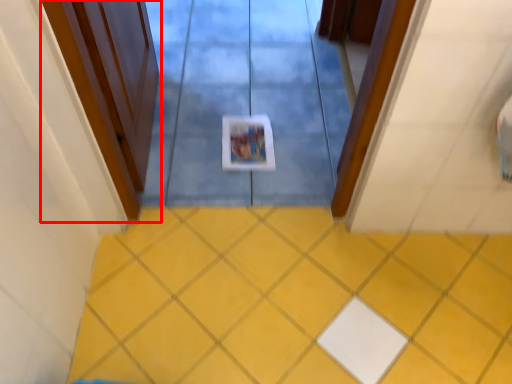
Question: From the image, what is the correct spatial relationship of door (annotated by the red box) in relation to ceramic tile?

Choices:
 (A) right
 (B) left

Answer: (B)